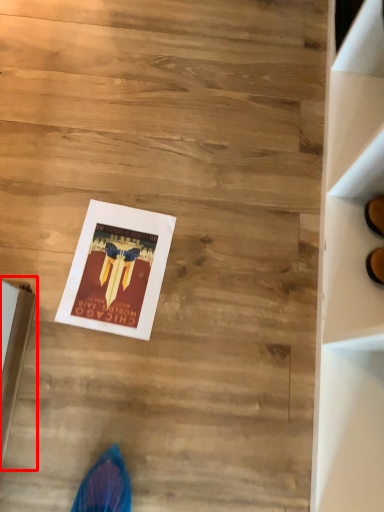
Question: From the image, what is the correct spatial relationship of cardboard box (annotated by the red box) in relation to magazine?

Choices:
 (A) right
 (B) left

Answer: (B)